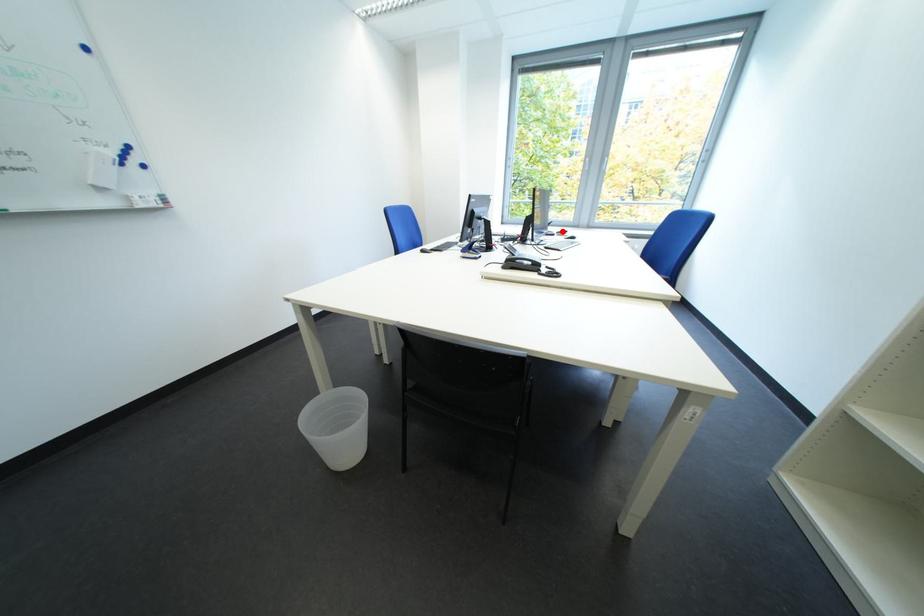
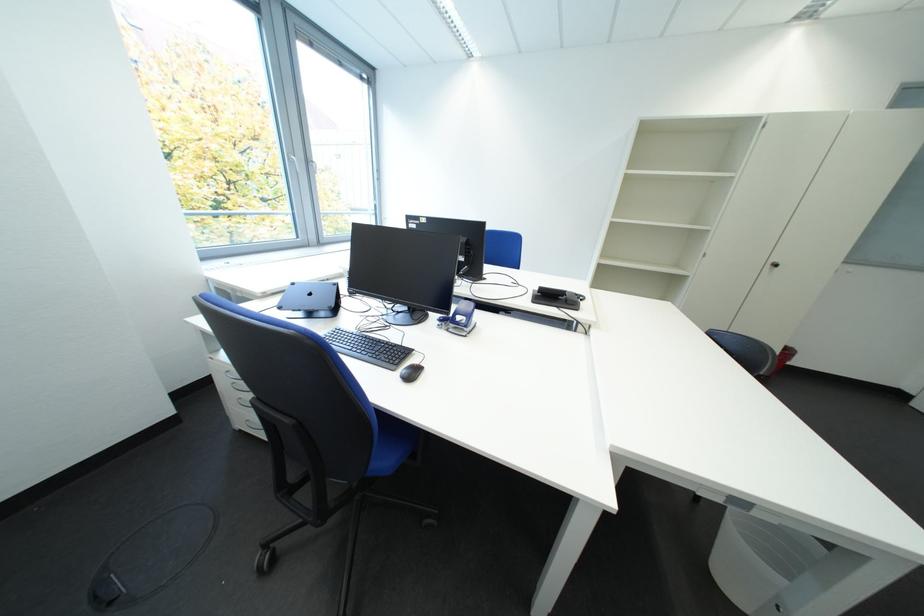
Question: I am providing you with two images of the same scene from different viewpoints. A red point is marked on the first image. At the location where the point appears in image 1, is it still visible in image 2?

Choices:
 (A) Yes
 (B) No

Answer: (B)